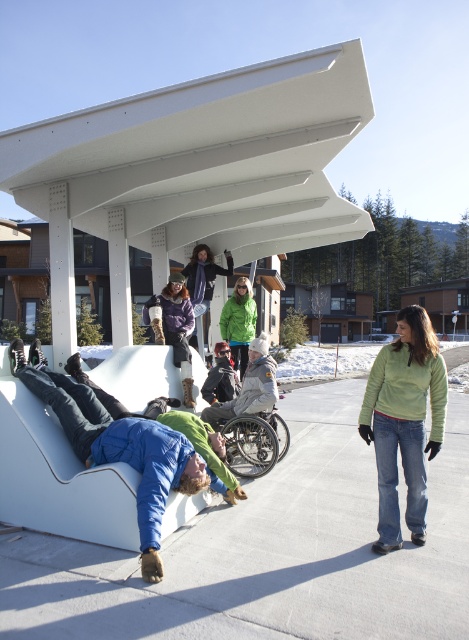
Question: Can you confirm if green fleece jacket at lower right is thinner than green matte jacket at center?

Choices:
 (A) no
 (B) yes

Answer: (A)

Question: Which object is the closest to the green fleece jacket at lower right?

Choices:
 (A) gray fabric wheelchair at center
 (B) purple fuzzy coat at upper center
 (C) silver metallic wheelchair at center

Answer: (C)

Question: Where is green fleece jacket at lower right located in relation to purple fuzzy coat at upper center in the image?

Choices:
 (A) left
 (B) right

Answer: (B)

Question: Which of the following is the farthest from the observer?

Choices:
 (A) (264, 448)
 (B) (411, 416)

Answer: (A)

Question: Is blue fleece jacket at lower left to the left of gray fabric wheelchair at center from the viewer's perspective?

Choices:
 (A) yes
 (B) no

Answer: (A)

Question: Considering the real-world distances, which object is closest to the green fleece jacket at lower right?

Choices:
 (A) dark gray fleece jacket at center
 (B) purple fuzzy coat at upper center
 (C) gray fabric wheelchair at center
 (D) green fleece jacket at center

Answer: (C)